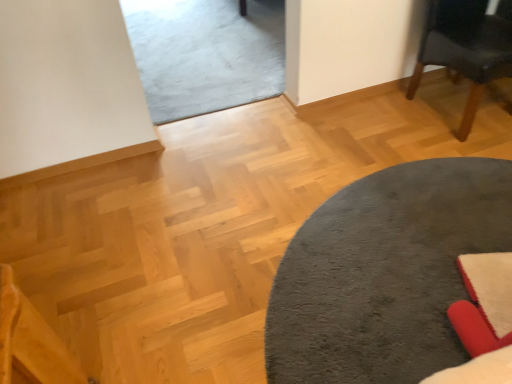
Question: Considering the relative sizes of dark gray plush rug at center and dark gray fabric chair at upper right in the image provided, is dark gray plush rug at center wider than dark gray fabric chair at upper right?

Choices:
 (A) yes
 (B) no

Answer: (A)

Question: Is dark gray plush rug at center positioned behind dark gray fabric chair at upper right?

Choices:
 (A) yes
 (B) no

Answer: (B)

Question: Is the depth of dark gray plush rug at center less than that of dark gray fabric chair at upper right?

Choices:
 (A) yes
 (B) no

Answer: (A)

Question: Does dark gray plush rug at center turn towards dark gray fabric chair at upper right?

Choices:
 (A) no
 (B) yes

Answer: (A)

Question: Is dark gray fabric chair at upper right a part of dark gray plush rug at center?

Choices:
 (A) no
 (B) yes

Answer: (A)

Question: Is dark gray plush rug at center positioned with its back to dark gray fabric chair at upper right?

Choices:
 (A) no
 (B) yes

Answer: (A)

Question: From the image's perspective, is dark gray fabric chair at upper right on dark gray plush rug at center?

Choices:
 (A) yes
 (B) no

Answer: (A)

Question: Are dark gray fabric chair at upper right and dark gray plush rug at center far apart?

Choices:
 (A) no
 (B) yes

Answer: (A)

Question: Can you confirm if dark gray fabric chair at upper right is thinner than dark gray plush rug at center?

Choices:
 (A) no
 (B) yes

Answer: (B)

Question: Considering the relative positions of dark gray fabric chair at upper right and dark gray plush rug at center in the image provided, is dark gray fabric chair at upper right behind dark gray plush rug at center?

Choices:
 (A) no
 (B) yes

Answer: (B)

Question: From a real-world perspective, is dark gray fabric chair at upper right located beneath dark gray plush rug at center?

Choices:
 (A) no
 (B) yes

Answer: (A)

Question: Does dark gray fabric chair at upper right have a greater height compared to dark gray plush rug at center?

Choices:
 (A) yes
 (B) no

Answer: (A)

Question: Considering the positions of dark gray plush rug at center and dark gray fabric chair at upper right in the image, is dark gray plush rug at center bigger or smaller than dark gray fabric chair at upper right?

Choices:
 (A) small
 (B) big

Answer: (A)